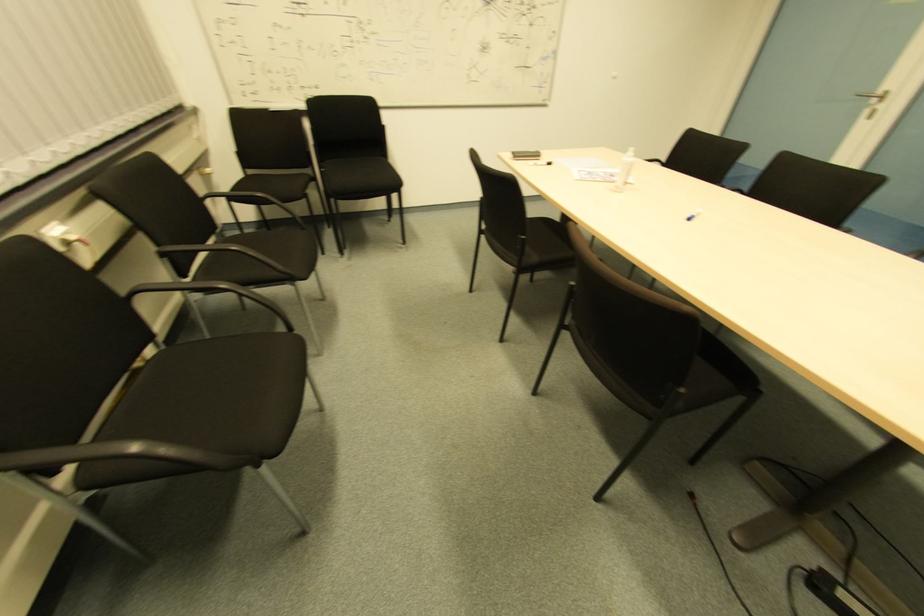
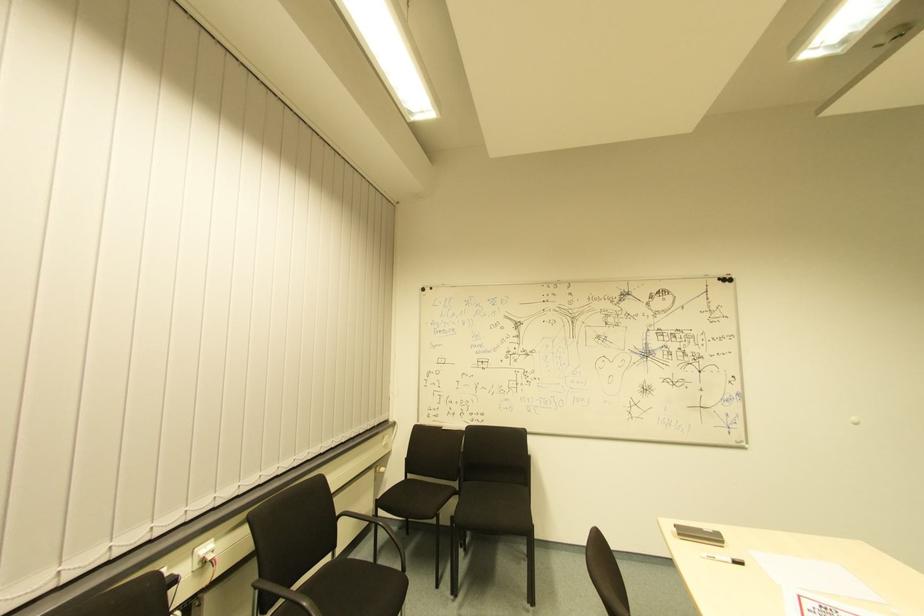
In the second image, find the point that corresponds to point (249, 176) in the first image.

(408, 479)